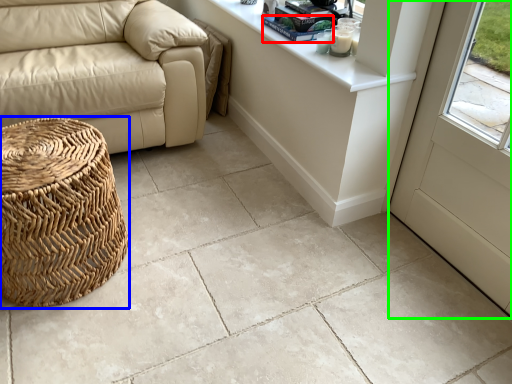
Question: Based on their relative distances, which object is farther from book (highlighted by a red box)? Choose from basket (highlighted by a blue box) and screen door (highlighted by a green box).

Choices:
 (A) basket
 (B) screen door

Answer: (A)